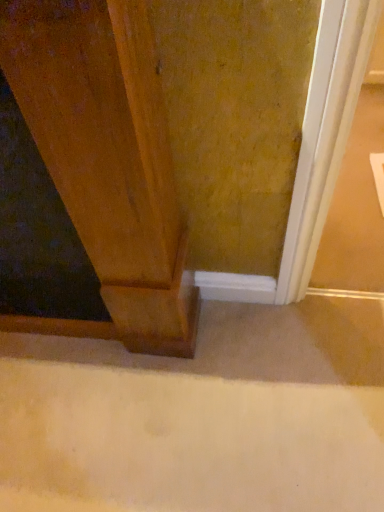
Question: Visually, is beige carpet at lower center positioned to the left or to the right of wooden door at left?

Choices:
 (A) left
 (B) right

Answer: (B)

Question: Do you think beige carpet at lower center is within wooden door at left, or outside of it?

Choices:
 (A) outside
 (B) inside

Answer: (A)

Question: Considering the positions of point (160, 406) and point (168, 292), is point (160, 406) closer or farther from the camera than point (168, 292)?

Choices:
 (A) farther
 (B) closer

Answer: (A)

Question: Based on their positions, is wooden door at left located to the left or right of beige carpet at lower center?

Choices:
 (A) left
 (B) right

Answer: (A)

Question: From the image's perspective, is wooden door at left located above or below beige carpet at lower center?

Choices:
 (A) below
 (B) above

Answer: (B)

Question: Looking at the image, does wooden door at left seem bigger or smaller compared to beige carpet at lower center?

Choices:
 (A) big
 (B) small

Answer: (A)

Question: Does point (157, 269) appear closer or farther from the camera than point (357, 463)?

Choices:
 (A) farther
 (B) closer

Answer: (B)